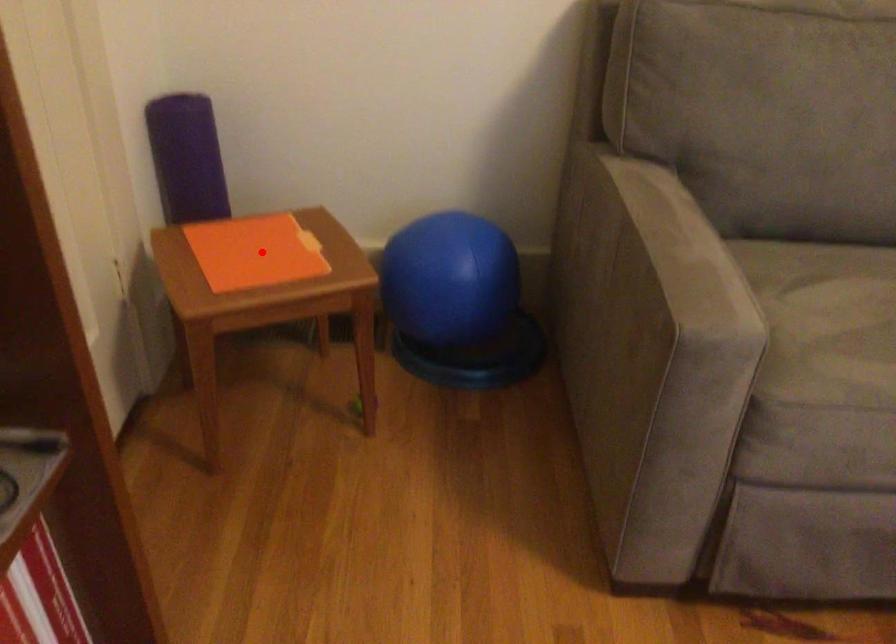
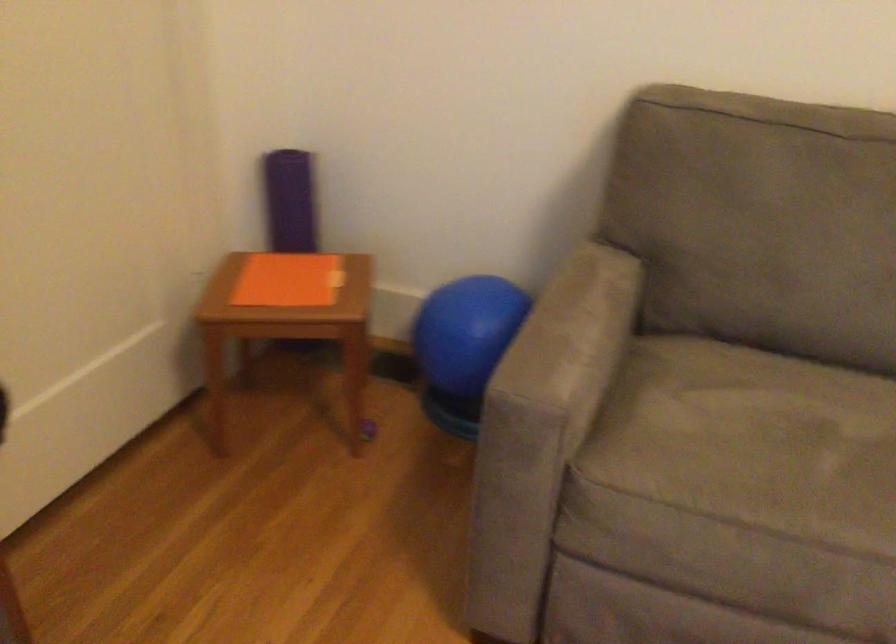
Find the pixel in the second image that matches the highlighted location in the first image.

(288, 279)